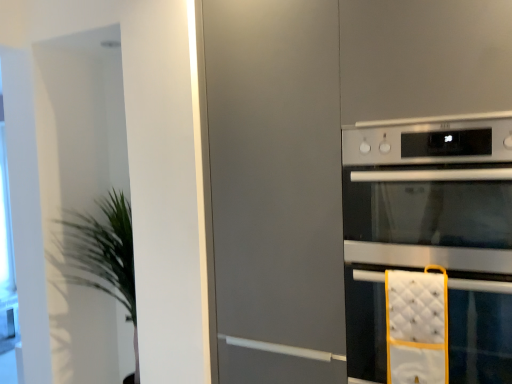
Question: Is green leafy plant at left turned away from satin silver oven at right?

Choices:
 (A) no
 (B) yes

Answer: (A)

Question: Is green leafy plant at left aimed at satin silver oven at right?

Choices:
 (A) yes
 (B) no

Answer: (B)

Question: From a real-world perspective, is green leafy plant at left below satin silver oven at right?

Choices:
 (A) yes
 (B) no

Answer: (A)

Question: Can we say green leafy plant at left lies outside satin silver oven at right?

Choices:
 (A) no
 (B) yes

Answer: (B)

Question: Can you confirm if green leafy plant at left is smaller than satin silver oven at right?

Choices:
 (A) yes
 (B) no

Answer: (B)

Question: Is green leafy plant at left at the left side of satin silver oven at right?

Choices:
 (A) no
 (B) yes

Answer: (B)

Question: From the image's perspective, is silver metallic oven at right located above satin silver oven at right?

Choices:
 (A) yes
 (B) no

Answer: (B)

Question: From the image's perspective, is silver metallic oven at right beneath satin silver oven at right?

Choices:
 (A) yes
 (B) no

Answer: (A)

Question: Considering the relative sizes of silver metallic oven at right and satin silver oven at right in the image provided, is silver metallic oven at right bigger than satin silver oven at right?

Choices:
 (A) yes
 (B) no

Answer: (A)

Question: Would you consider silver metallic oven at right to be distant from satin silver oven at right?

Choices:
 (A) yes
 (B) no

Answer: (B)

Question: Is silver metallic oven at right thinner than satin silver oven at right?

Choices:
 (A) no
 (B) yes

Answer: (B)

Question: Is satin silver oven at right surrounded by silver metallic oven at right?

Choices:
 (A) no
 (B) yes

Answer: (A)

Question: Is satin silver oven at right smaller than silver metallic oven at right?

Choices:
 (A) no
 (B) yes

Answer: (B)